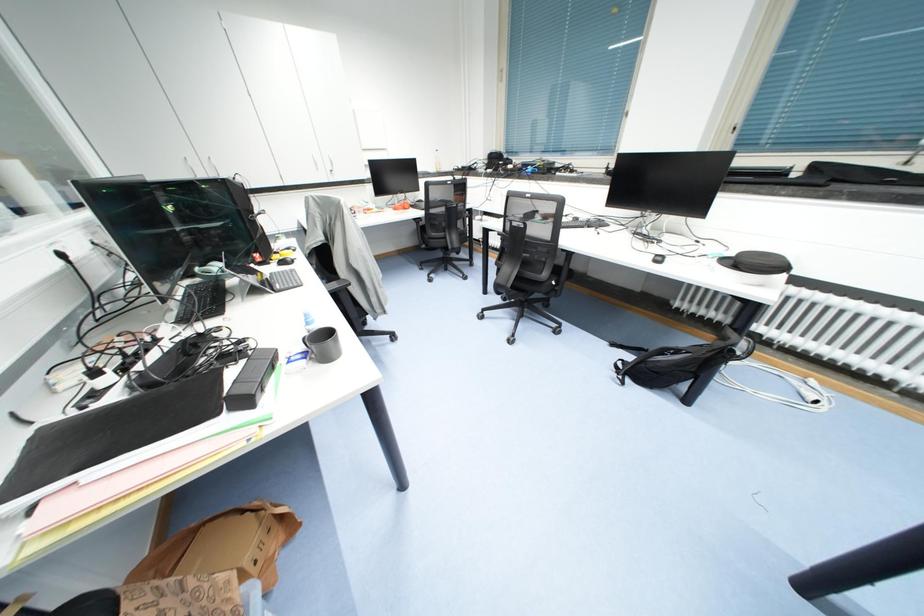
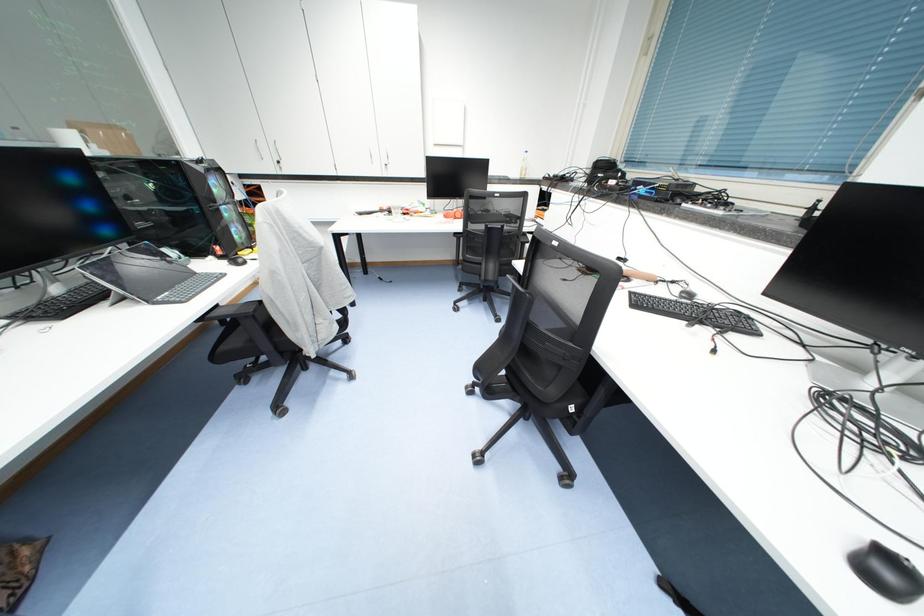
Which direction would the cameraman need to move to produce the second image?

The cameraman moved toward right, forward.